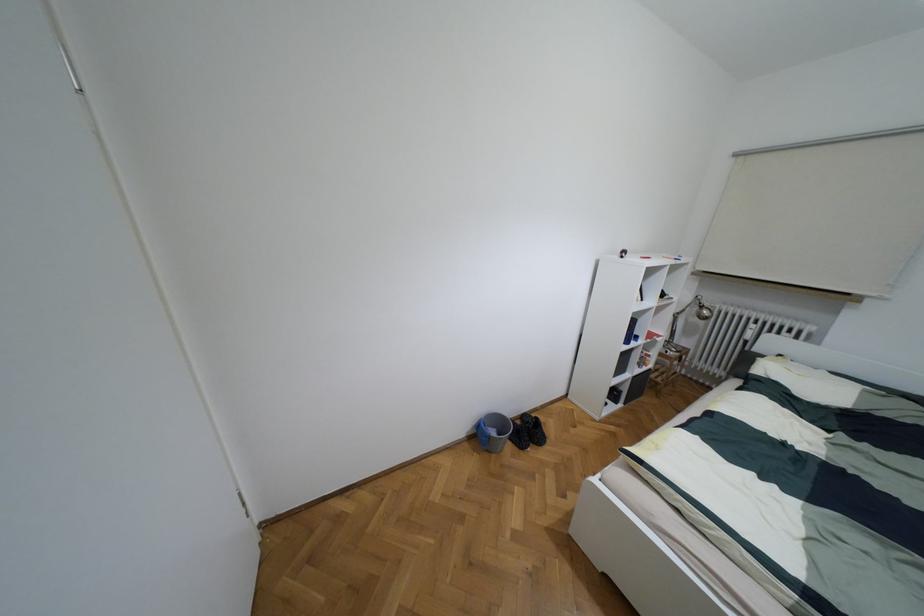
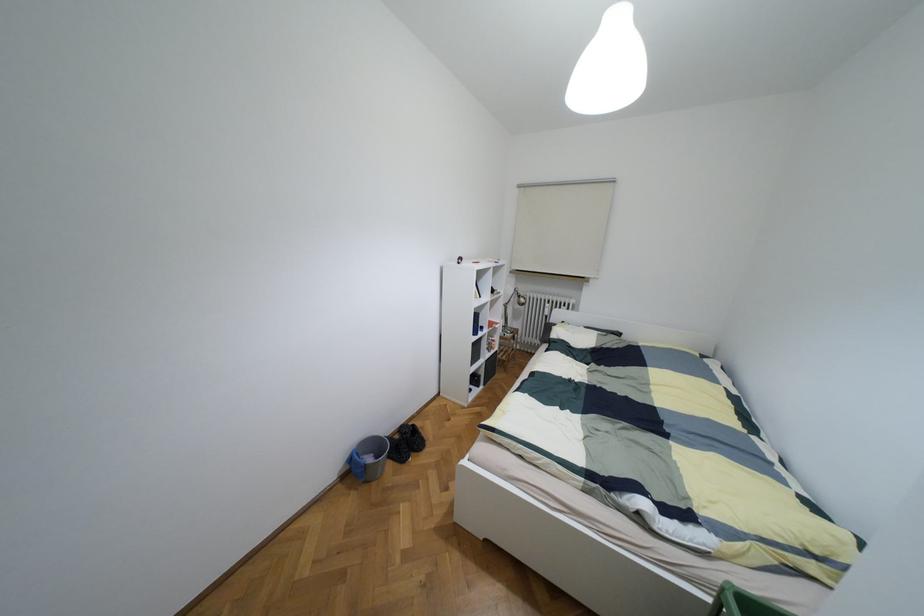
Locate, in the second image, the point that corresponds to point (699, 306) in the first image.

(517, 296)